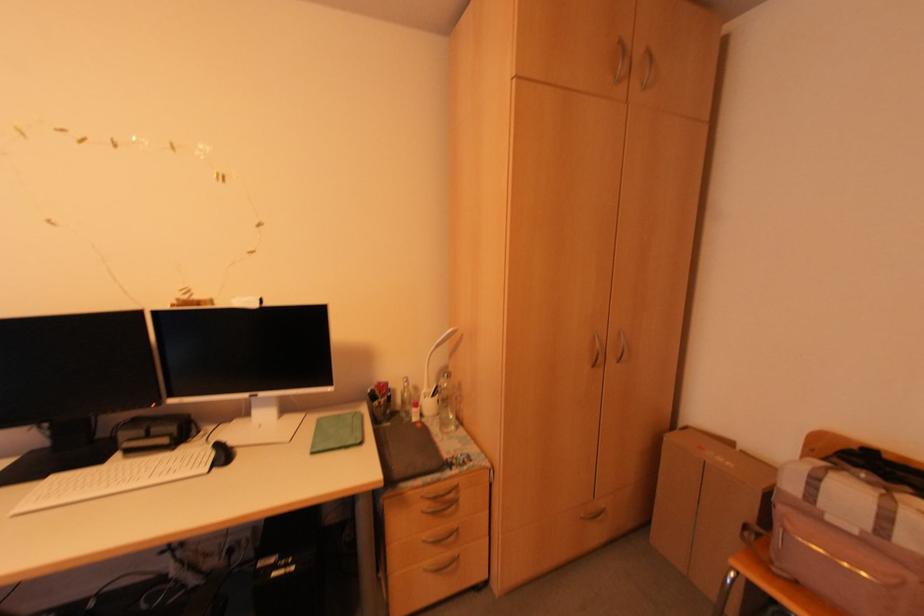
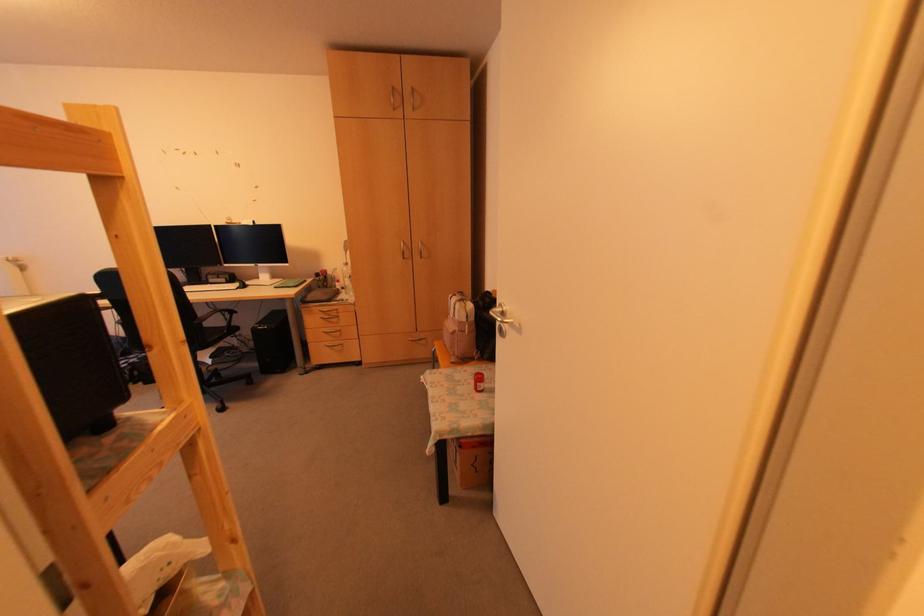
Which direction would the cameraman need to move to produce the second image?

The movement direction of the cameraman is right, backward.